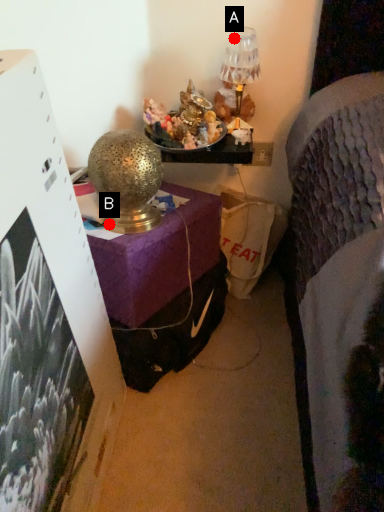
Question: Two points are circled on the image, labeled by A and B beside each circle. Which point is closer to the camera taking this photo?

Choices:
 (A) A is closer
 (B) B is closer

Answer: (B)